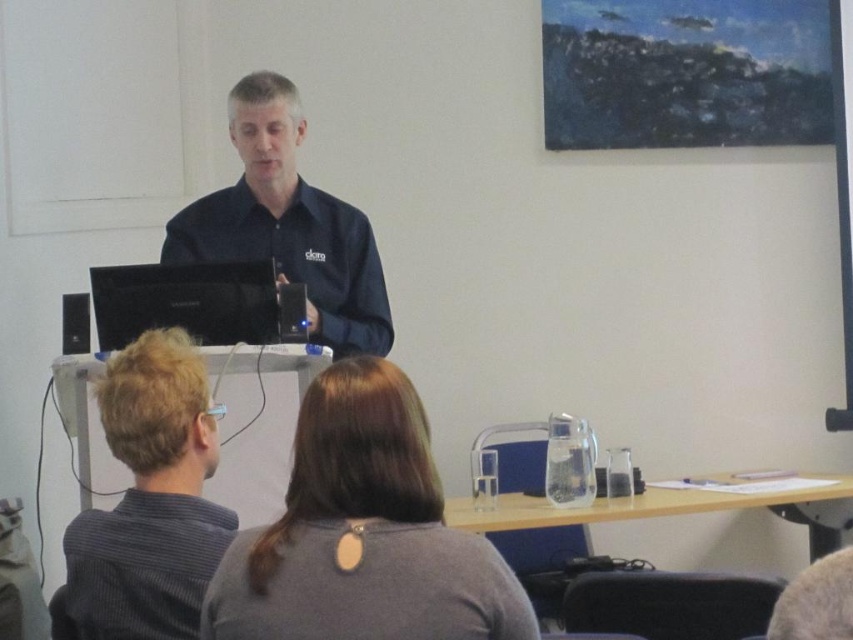
You are organizing a photo shoot and need to arrange two models wearing the gray fabric shirt at center and the gray striped shirt at lower left. Based on their heights, which model should stand in front to ensure both are visible in the photo?

A: The gray fabric shirt at center should stand in front because it is shorter than the gray striped shirt at lower left, allowing the taller model to be seen over the shorter one.

You are an attendee in the conference room and want to locate the presenter. Where is the dark blue shirt at center in relation to the black glossy laptop at center?

The dark blue shirt at center is in front of the black glossy laptop at center because the laptop is behind the shirt.

You are sitting at the back of the room and want to hand a document to the person wearing the gray fabric shirt at center and the gray striped shirt at lower left. Which one can you reach without moving from your seat?

The gray fabric shirt at center is closer to the viewer than the gray striped shirt at lower left, so you can reach the person wearing the gray fabric shirt at center without moving from your seat.